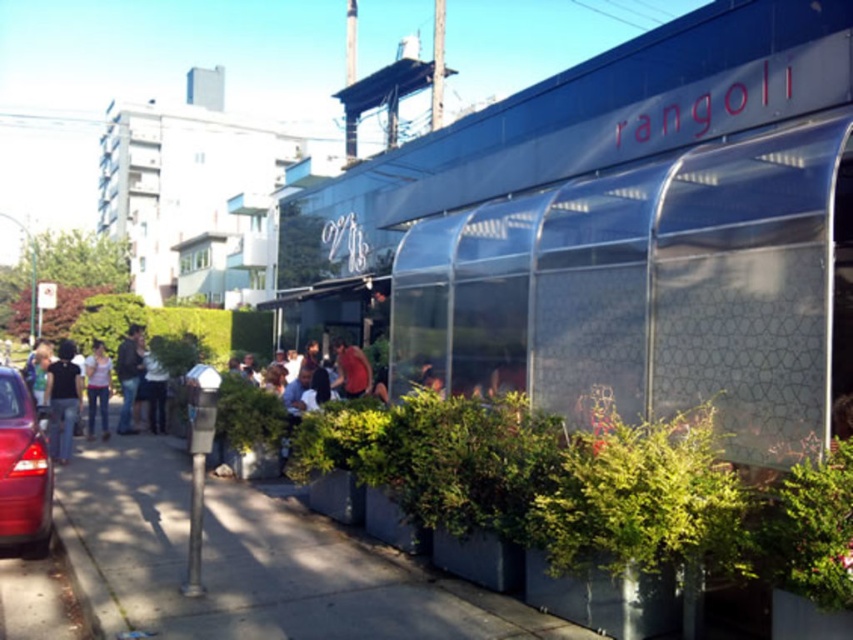
Measure the distance between point (53, 372) and camera.

Point (53, 372) is 39.08 feet away from camera.

Which is below, matte black shirt at left or denim jeans at left?

denim jeans at left is below.

Locate an element on the screen. The image size is (853, 640). matte black shirt at left is located at coordinates (62, 401).

Locate an element on the screen. matte black shirt at left is located at coordinates (62, 401).

Locate an element on the screen. This screenshot has width=853, height=640. denim jacket at left is located at coordinates (128, 374).

Is point (132, 429) farther from viewer compared to point (368, 385)?

Yes, point (132, 429) is behind point (368, 385).

Identify the location of denim jacket at left. Image resolution: width=853 pixels, height=640 pixels. (128, 374).

Which is above, denim jacket at left or denim jeans at left?

denim jeans at left is above.

Can you confirm if denim jacket at left is wider than denim jeans at left?

No.

Image resolution: width=853 pixels, height=640 pixels. What do you see at coordinates (128, 374) in the screenshot?
I see `denim jacket at left` at bounding box center [128, 374].

This screenshot has width=853, height=640. In order to click on denim jacket at left in this screenshot , I will do `click(128, 374)`.